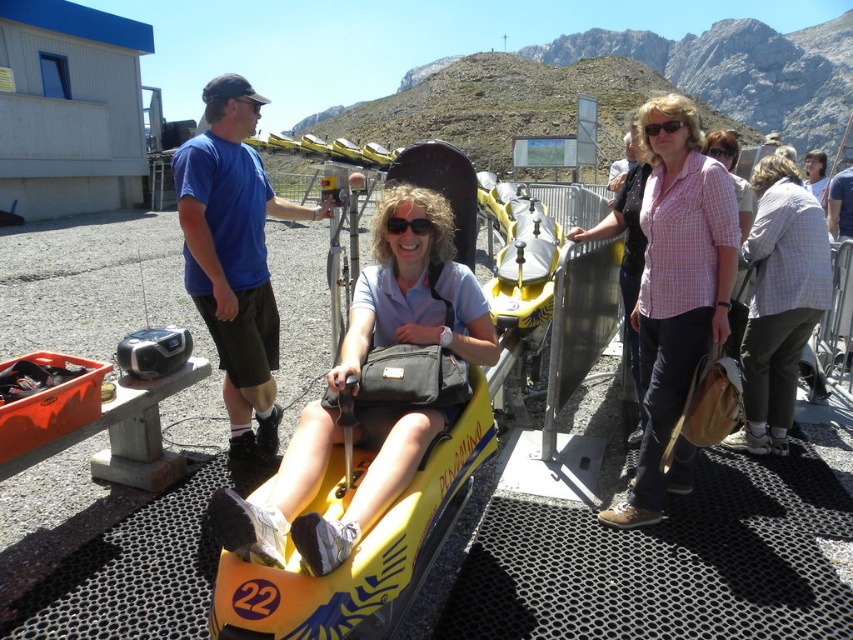
You are a photographer positioned at the origin point of the coordinate system. You need to capture a closeup shot of the matte pink shirt at center. Based on the coordinates provided in the description, in which direction should you move your camera to focus on the shirt?

The matte pink shirt at center is located at point 0.273 on the x axis and 0.958 on the y axis. Since the origin is at the bottom left corner, moving the camera to the right and upwards will position it correctly to focus on the shirt.

You are a photographer positioned at the edge of the bobsled track. You need to capture a clear photo of both the matte pink shirt at center and the black matte goggles at center. Which object should you focus on first to ensure both are in frame?

Since the matte pink shirt at center might be wider than black matte goggles at center, you should focus on the matte pink shirt at center first to ensure both objects fit within the camera frame.

You are a photographer at the scene. You want to capture a photo where both the blue cotton shirt at left and the transparent plastic goggles at center are visible. Considering their sizes, which object should you focus on to ensure both are in frame?

The blue cotton shirt at left is larger than the transparent plastic goggles at center, so focusing on the shirt will ensure both are in frame as the goggles are smaller and easier to include.